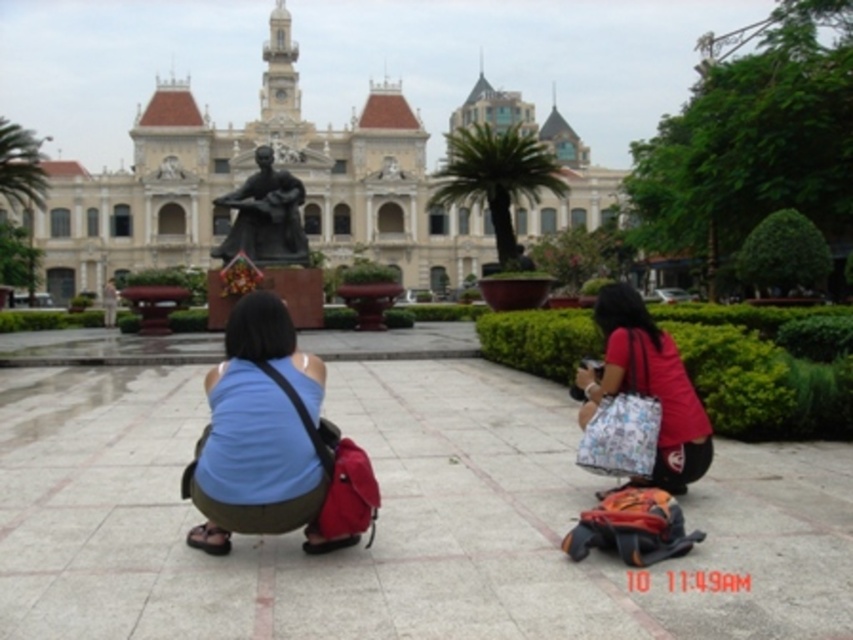
Which is more to the left, matte red shirt at lower right or bronze statue at center?

Positioned to the left is bronze statue at center.

Measure the distance between point (685, 433) and camera.

A distance of 251.61 feet exists between point (685, 433) and camera.

The image size is (853, 640). Identify the location of matte red shirt at lower right. (648, 387).

From the picture: Is white stone building at center in front of matte red shirt at lower right?

No, it is not.

Is point (80, 211) positioned behind point (624, 380)?

Yes.

Between point (172, 83) and point (659, 456), which one is positioned behind?

The point (172, 83) is behind.

This screenshot has height=640, width=853. I want to click on white stone building at center, so click(x=247, y=177).

Does blue fabric tank top at center come behind bronze statue at center?

No, blue fabric tank top at center is closer to the viewer.

Measure the distance between blue fabric tank top at center and camera.

69.54 meters

Describe the element at coordinates (259, 435) in the screenshot. I see `blue fabric tank top at center` at that location.

In order to click on blue fabric tank top at center in this screenshot , I will do `click(259, 435)`.